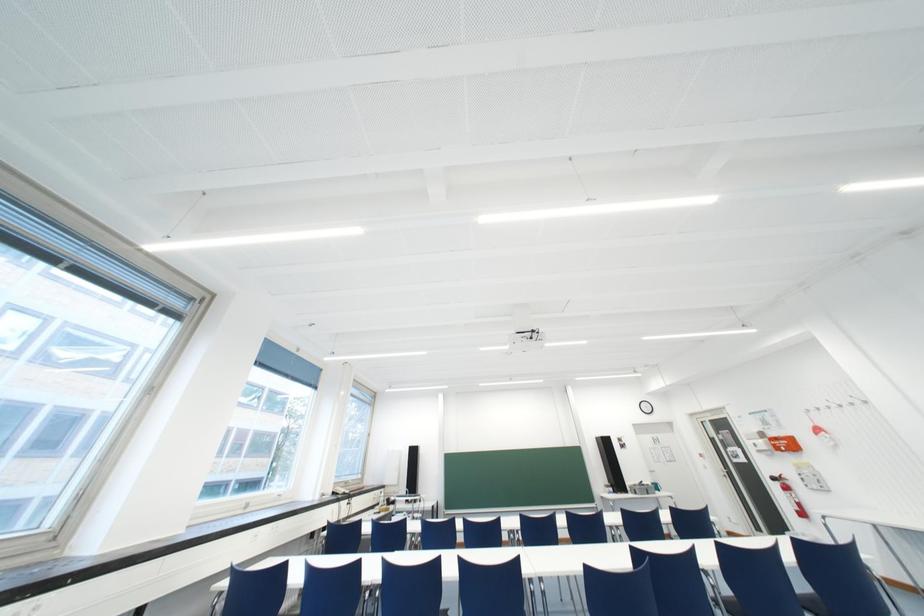
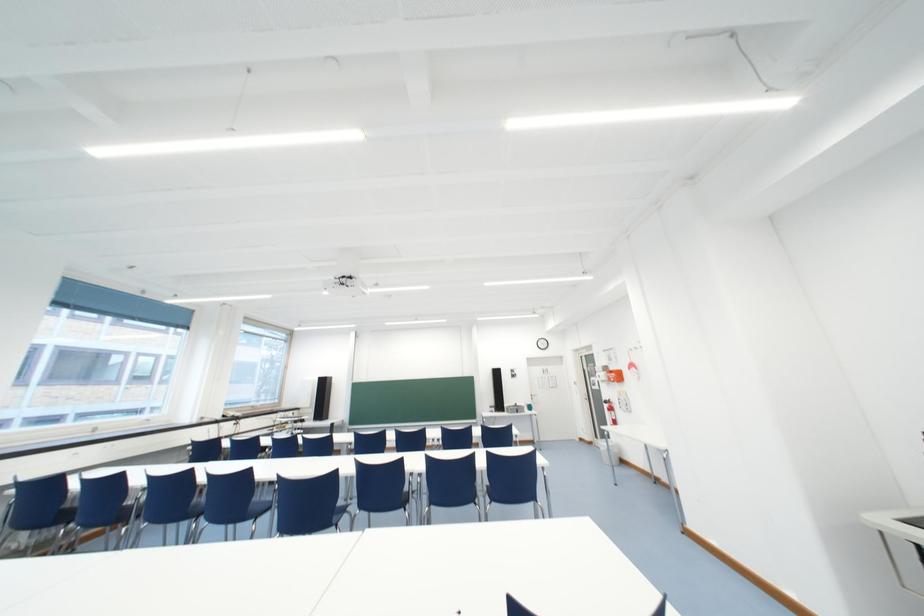
Question: The images are taken continuously from a first-person perspective. In which direction are you moving?

Choices:
 (A) Left
 (B) Right
 (C) Forward
 (D) Backward

Answer: (B)